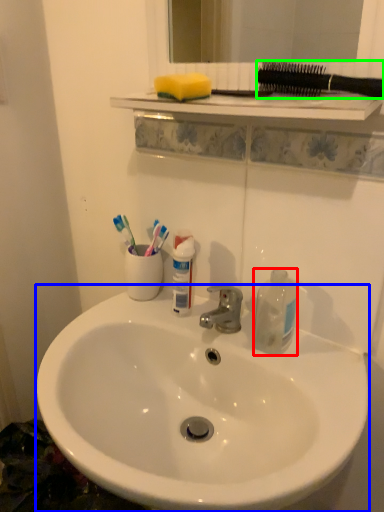
Question: Which object is positioned farthest from bottle (highlighted by a red box)? Select from sink (highlighted by a blue box) and toothbrushes (highlighted by a green box).

Choices:
 (A) sink
 (B) toothbrushes

Answer: (B)